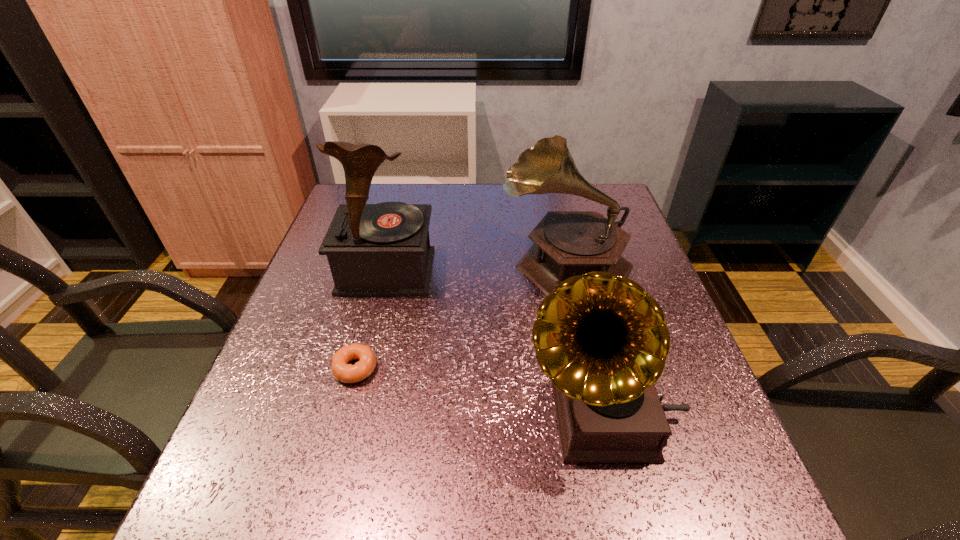
This screenshot has height=540, width=960. I want to click on doughnut at the left edge, so click(341, 370).

I want to click on object that is at the far right corner, so pos(566,243).

The image size is (960, 540). Identify the location of vacant space at the far edge of the desktop. (549, 195).

Where is `vacant position at the near edge of the desktop`? The width and height of the screenshot is (960, 540). vacant position at the near edge of the desktop is located at coordinates (450, 488).

Image resolution: width=960 pixels, height=540 pixels. In the image, there is a desktop. In order to click on vacant space at the left edge in this screenshot , I will do `click(300, 424)`.

Locate an element on the screen. The width and height of the screenshot is (960, 540). blank space at the near left corner is located at coordinates (229, 519).

The width and height of the screenshot is (960, 540). In the image, there is a desktop. Find the location of `free space at the far right corner`. free space at the far right corner is located at coordinates (590, 202).

The image size is (960, 540). Identify the location of free space at the near right corner of the desktop. (711, 489).

Find the location of a particular element. free space between the leftmost phonograph record and the nearest phonograph record is located at coordinates (494, 343).

Identify the location of vacant area that lies between the doughnut and the leftmost phonograph record. Image resolution: width=960 pixels, height=540 pixels. (371, 320).